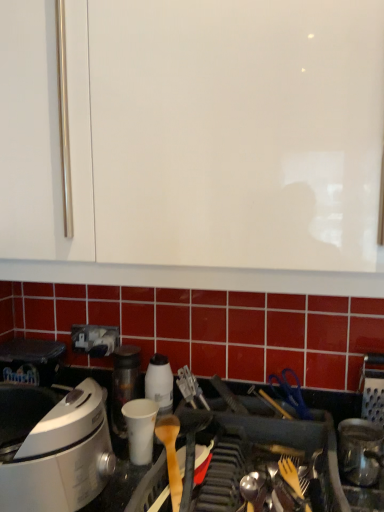
Question: Which direction should I rotate to look at white glossy container at center, which is counted as the first kitchen appliance, starting from the back, — up or down?

Choices:
 (A) down
 (B) up

Answer: (A)

Question: Should I look upward or downward to see white paper cup at center?

Choices:
 (A) down
 (B) up

Answer: (A)

Question: Considering the relative positions of white glossy container at center, positioned as the second kitchen appliance in front-to-back order, and shiny metallic canister at lower right, the 1th kitchen appliance from the right, in the image provided, is white glossy container at center, positioned as the second kitchen appliance in front-to-back order, to the right of shiny metallic canister at lower right, the 1th kitchen appliance from the right, from the viewer's perspective?

Choices:
 (A) yes
 (B) no

Answer: (B)

Question: Is white glossy container at center, which appears as the first kitchen appliance when viewed from the left, turned away from shiny metallic canister at lower right, the 1th kitchen appliance from the right?

Choices:
 (A) no
 (B) yes

Answer: (A)

Question: Does white glossy container at center, which appears as the first kitchen appliance when viewed from the left, lie behind shiny metallic canister at lower right, the 1th kitchen appliance from the right?

Choices:
 (A) yes
 (B) no

Answer: (A)

Question: Does white glossy container at center, which appears as the first kitchen appliance when viewed from the left, have a smaller size compared to shiny metallic canister at lower right, the 2th kitchen appliance when ordered from back to front?

Choices:
 (A) no
 (B) yes

Answer: (B)

Question: Could shiny metallic canister at lower right, the 1th kitchen appliance from the right, be considered to be inside white glossy container at center, arranged as the 2th kitchen appliance when viewed from the right?

Choices:
 (A) no
 (B) yes

Answer: (A)

Question: Is white glossy container at center, which appears as the first kitchen appliance when viewed from the left, located outside shiny metallic canister at lower right, the 2th kitchen appliance when ordered from back to front?

Choices:
 (A) yes
 (B) no

Answer: (A)

Question: Considering the relative sizes of white paper cup at center and shiny metallic canister at lower right, the 2th kitchen appliance when ordered from back to front, in the image provided, is white paper cup at center wider than shiny metallic canister at lower right, the 2th kitchen appliance when ordered from back to front,?

Choices:
 (A) yes
 (B) no

Answer: (B)

Question: From the image's perspective, is white paper cup at center above shiny metallic canister at lower right, the 2th kitchen appliance when ordered from back to front?

Choices:
 (A) yes
 (B) no

Answer: (A)

Question: Is white paper cup at center thinner than shiny metallic canister at lower right, the first kitchen appliance in the front-to-back sequence?

Choices:
 (A) yes
 (B) no

Answer: (A)

Question: From a real-world perspective, is white paper cup at center located higher than shiny metallic canister at lower right, positioned as the second kitchen appliance in left-to-right order?

Choices:
 (A) no
 (B) yes

Answer: (B)

Question: From a real-world perspective, is white paper cup at center under shiny metallic canister at lower right, the 1th kitchen appliance from the right?

Choices:
 (A) yes
 (B) no

Answer: (B)

Question: Could you tell me if white paper cup at center is facing shiny metallic canister at lower right, positioned as the second kitchen appliance in left-to-right order?

Choices:
 (A) no
 (B) yes

Answer: (A)

Question: Is shiny metallic canister at lower right, positioned as the second kitchen appliance in left-to-right order, far from white paper cup at center?

Choices:
 (A) yes
 (B) no

Answer: (B)